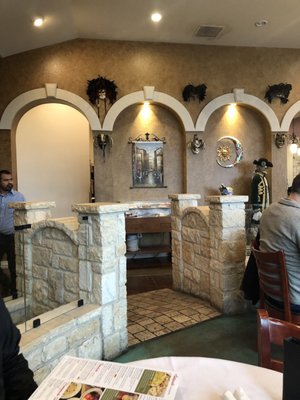
The image size is (300, 400). Find the location of `vent in ceiling`. vent in ceiling is located at coordinates (206, 30).